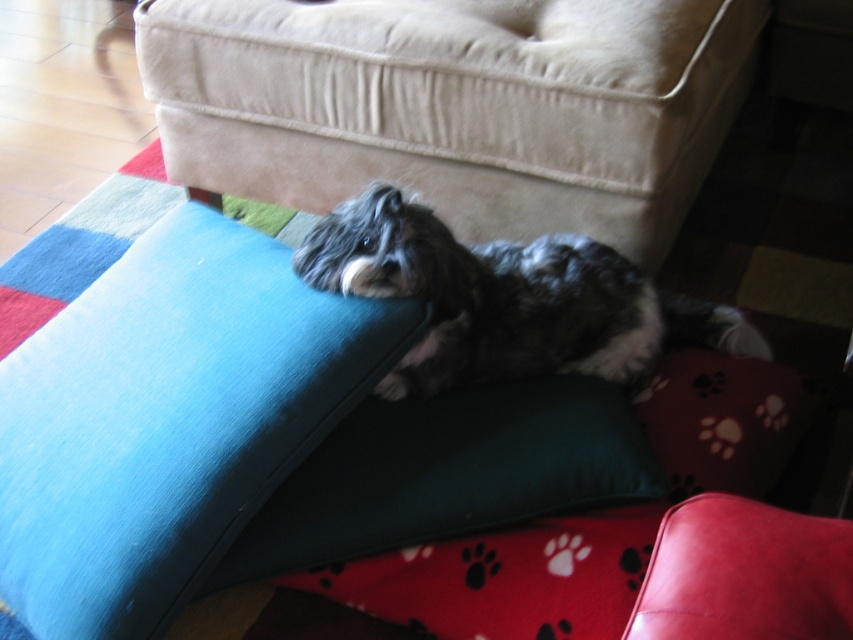
Question: Is shaggy fur dog at center smaller than fluffy gray dog at center?

Choices:
 (A) no
 (B) yes

Answer: (A)

Question: Among these points, which one is farthest from the camera?

Choices:
 (A) (158, 32)
 (B) (630, 308)
 (C) (368, 516)
 (D) (91, 508)

Answer: (A)

Question: Which of the following is the closest to the observer?

Choices:
 (A) (114, 600)
 (B) (432, 404)
 (C) (593, 298)
 (D) (268, 113)

Answer: (A)

Question: Does shaggy fur dog at center have a greater width compared to dark green fabric pillow at center?

Choices:
 (A) no
 (B) yes

Answer: (B)

Question: Considering the real-world distances, which object is farthest from the dark green fabric pillow at center?

Choices:
 (A) fluffy gray dog at center
 (B) teal fabric cushion at upper left
 (C) shaggy fur dog at center

Answer: (C)

Question: Is shaggy fur dog at center positioned behind teal fabric cushion at upper left?

Choices:
 (A) no
 (B) yes

Answer: (B)